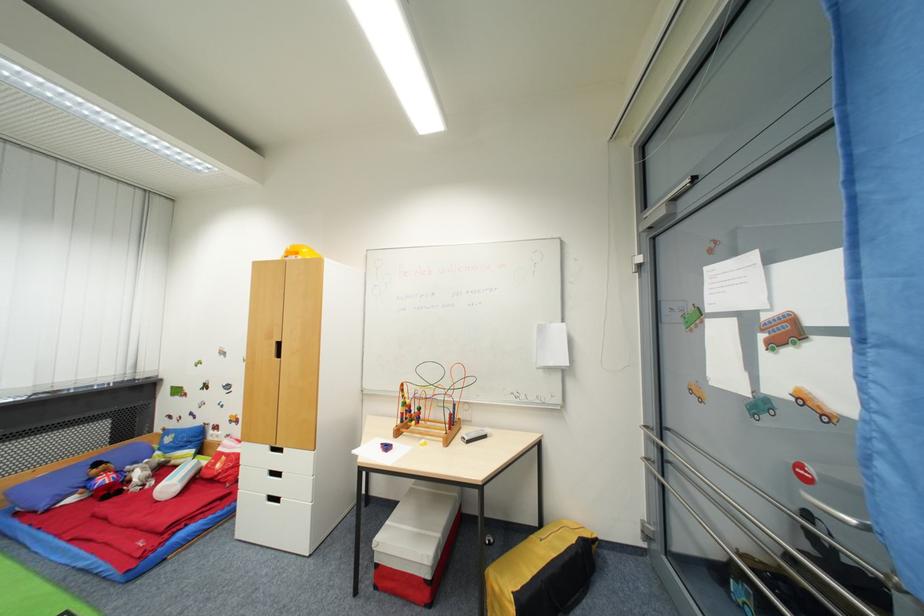
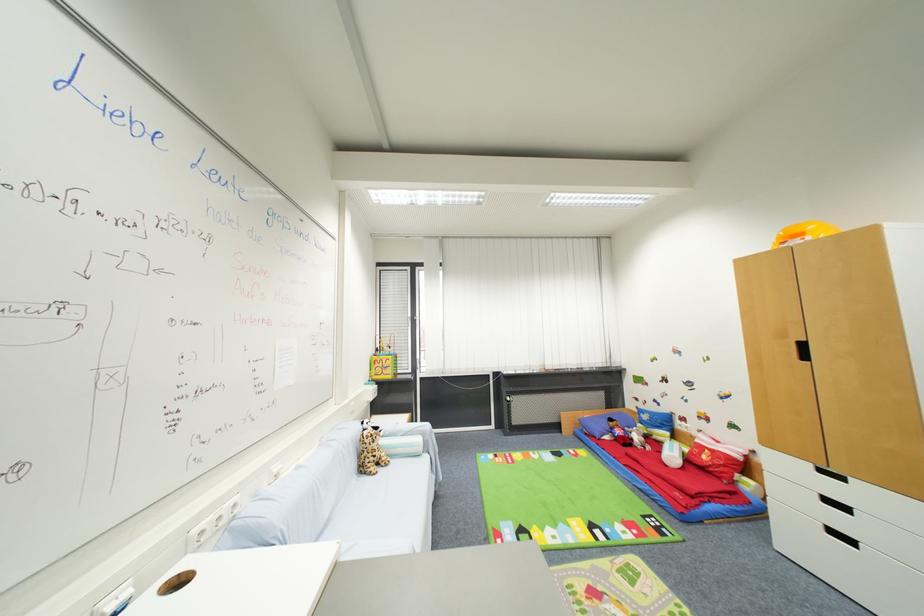
The point at (94, 562) is marked in the first image. Where is the corresponding point in the second image?

(650, 488)